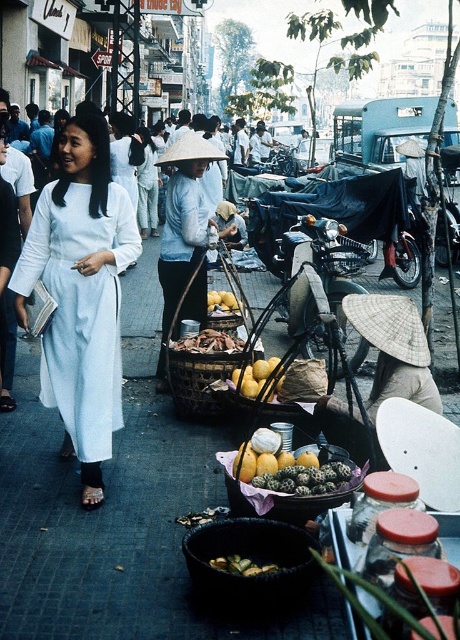
You are a delivery person carrying a package that is 1.5 meters long. You need to place it between the black woven basket at lower center and the yellow matte fruit at center. Is there enough space?

The distance between the black woven basket at lower center and the yellow matte fruit at center is 1.51 meters. Since the package is 1.5 meters long, there is just enough space to fit it between them.

You are a customer at this market and want to buy both the black woven basket at lower center and the yellow matte fruit at center. If you want to carry both items in your shopping bag, which item should you place first to ensure both fit?

The black woven basket at lower center occupies less space than the yellow matte fruit at center, so you should place the yellow matte fruit at center first to ensure both fit in your shopping bag.